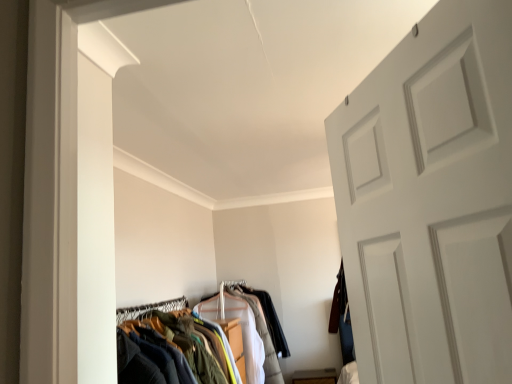
Find the location of `textured fabric clothes at center`. textured fabric clothes at center is located at coordinates (270, 320).

Describe the element at coordinates (270, 320) in the screenshot. I see `textured fabric clothes at center` at that location.

This screenshot has height=384, width=512. Find the location of `white cotton shirt at center`. white cotton shirt at center is located at coordinates (254, 337).

Measure the distance between white cotton shirt at center and camera.

white cotton shirt at center and camera are 2.98 meters apart.

What do you see at coordinates (254, 337) in the screenshot? I see `white cotton shirt at center` at bounding box center [254, 337].

The height and width of the screenshot is (384, 512). Identify the location of textured fabric clothes at center. (270, 320).

Is white cotton shirt at center to the left of textured fabric clothes at center from the viewer's perspective?

In fact, white cotton shirt at center is to the right of textured fabric clothes at center.

Considering the positions of objects white cotton shirt at center and textured fabric clothes at center in the image provided, who is behind, white cotton shirt at center or textured fabric clothes at center?

white cotton shirt at center is further from the camera.

Is point (280, 370) behind point (282, 334)?

No, (280, 370) is in front of (282, 334).

From the image's perspective, is white cotton shirt at center beneath textured fabric clothes at center?

Yes.

From a real-world perspective, who is located higher, white cotton shirt at center or textured fabric clothes at center?

From a 3D spatial view, textured fabric clothes at center is above.

Between white cotton shirt at center and textured fabric clothes at center, which one has smaller width?

textured fabric clothes at center is thinner.

Between white cotton shirt at center and textured fabric clothes at center, which one has less height?

With less height is textured fabric clothes at center.

Considering the sizes of white cotton shirt at center and textured fabric clothes at center in the image, is white cotton shirt at center bigger or smaller than textured fabric clothes at center?

Considering their sizes, white cotton shirt at center takes up more space than textured fabric clothes at center.

Is white cotton shirt at center situated inside textured fabric clothes at center or outside?

white cotton shirt at center is not enclosed by textured fabric clothes at center.

Is white cotton shirt at center positioned far away from textured fabric clothes at center?

That's not correct — white cotton shirt at center is a little close to textured fabric clothes at center.

Could you tell me if white cotton shirt at center is turned towards textured fabric clothes at center?

No, white cotton shirt at center is not turned towards textured fabric clothes at center.

In the image, there is a textured fabric clothes at center. At what (x,y) coordinates should I click in order to perform the action: click on clothing below it (from the image's perspective). Please return your answer as a coordinate pair (x, y). The height and width of the screenshot is (384, 512). Looking at the image, I should click on (254, 337).

Considering the positions of objects textured fabric clothes at center and white cotton shirt at center in the image provided, who is more to the left, textured fabric clothes at center or white cotton shirt at center?

textured fabric clothes at center.

Does textured fabric clothes at center come in front of white cotton shirt at center?

Yes, textured fabric clothes at center is closer to the viewer.

Considering the points (248, 292) and (238, 310), which point is behind, point (248, 292) or point (238, 310)?

The point (248, 292) is farther.

From the image's perspective, is textured fabric clothes at center beneath white cotton shirt at center?

No, from the image's perspective, textured fabric clothes at center is not beneath white cotton shirt at center.

From a real-world perspective, who is located higher, textured fabric clothes at center or white cotton shirt at center?

textured fabric clothes at center, from a real-world perspective.

In the scene shown: Is textured fabric clothes at center wider than white cotton shirt at center?

No, textured fabric clothes at center is not wider than white cotton shirt at center.

Does textured fabric clothes at center have a greater height compared to white cotton shirt at center?

Incorrect, the height of textured fabric clothes at center is not larger of that of white cotton shirt at center.

Based on their sizes in the image, would you say textured fabric clothes at center is bigger or smaller than white cotton shirt at center?

Clearly, textured fabric clothes at center is smaller in size than white cotton shirt at center.

Is white cotton shirt at center completely or partially inside textured fabric clothes at center?

No, white cotton shirt at center is not a part of textured fabric clothes at center.

Would you consider textured fabric clothes at center to be distant from white cotton shirt at center?

textured fabric clothes at center is near white cotton shirt at center, not far away.

Could you tell me if textured fabric clothes at center is facing white cotton shirt at center?

No, textured fabric clothes at center is not oriented towards white cotton shirt at center.

How many degrees apart are the facing directions of textured fabric clothes at center and white cotton shirt at center?

The facing directions of textured fabric clothes at center and white cotton shirt at center are 1.93 degrees apart.

From the picture: How far apart are textured fabric clothes at center and white cotton shirt at center?

11.27 inches.

This screenshot has width=512, height=384. What are the coordinates of `clothing to the right of textured fabric clothes at center` in the screenshot? It's located at (254, 337).

You are a GUI agent. You are given a task and a screenshot of the screen. Output one action in this format:
    pyautogui.click(x=<x>, y=<y>)
    Task: Click on the clothing behind the textured fabric clothes at center
    
    Given the screenshot: What is the action you would take?
    pyautogui.click(x=254, y=337)

Where is `clothing below the textured fabric clothes at center (from the image's perspective)`? clothing below the textured fabric clothes at center (from the image's perspective) is located at coordinates (254, 337).